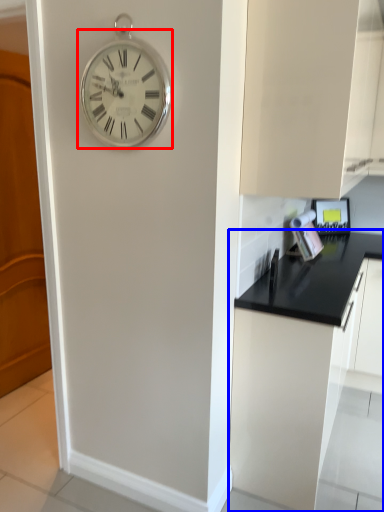
Question: Which point is closer to the camera, wall clock (highlighted by a red box) or cabinetry (highlighted by a blue box)?

Choices:
 (A) wall clock
 (B) cabinetry

Answer: (A)